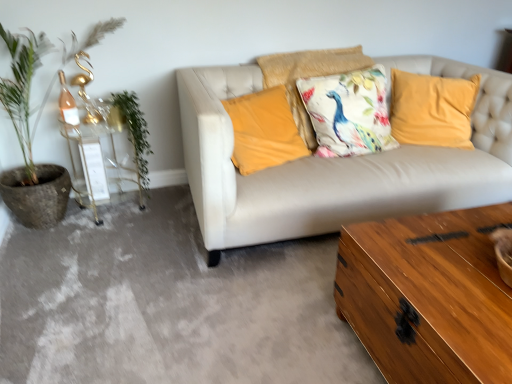
Where is `wooden chest at lower right`? The height and width of the screenshot is (384, 512). wooden chest at lower right is located at coordinates (169, 304).

The image size is (512, 384). I want to click on clear glass side table at left, so click(x=87, y=153).

Image resolution: width=512 pixels, height=384 pixels. Identify the location of green leafy plant at left. (24, 88).

The image size is (512, 384). What do you see at coordinates (349, 112) in the screenshot?
I see `floral cotton cushion at center, which ranks as the 3th pillow in left-to-right order` at bounding box center [349, 112].

Measure the distance between floral fabric cushion at center, which ranks as the second pillow in right-to-left order, and camera.

A distance of 8.14 feet exists between floral fabric cushion at center, which ranks as the second pillow in right-to-left order, and camera.

What do you see at coordinates (308, 77) in the screenshot?
I see `floral fabric cushion at center, which ranks as the second pillow in right-to-left order` at bounding box center [308, 77].

You are a GUI agent. You are given a task and a screenshot of the screen. Output one action in this format:
    pyautogui.click(x=<x>, y=<y>)
    Task: Click on the green leafy plant at left
    
    Given the screenshot: What is the action you would take?
    pyautogui.click(x=135, y=137)

This screenshot has height=384, width=512. What do you see at coordinates (264, 130) in the screenshot?
I see `velvet yellow pillow at center, the 3th pillow when ordered from right to left` at bounding box center [264, 130].

Find the location of a particular element. This screenshot has width=512, height=384. wooden chest at lower right is located at coordinates (169, 304).

From a real-world perspective, which is physically above, floral cotton cushion at center, which ranks as the 3th pillow in left-to-right order, or shiny brown wooden trunk at lower right?

floral cotton cushion at center, which ranks as the 3th pillow in left-to-right order, is physically above.

Is floral cotton cushion at center, which ranks as the 3th pillow in left-to-right order, to the left or to the right of shiny brown wooden trunk at lower right in the image?

Based on their positions, floral cotton cushion at center, which ranks as the 3th pillow in left-to-right order, is located to the left of shiny brown wooden trunk at lower right.

Which is more to the right, green leafy plant at left or wooden chest at lower right?

wooden chest at lower right is more to the right.

Are green leafy plant at left and wooden chest at lower right far apart?

green leafy plant at left is near wooden chest at lower right, not far away.

Is wooden chest at lower right inside green leafy plant at left?

No, wooden chest at lower right is not surrounded by green leafy plant at left.

Which is behind, point (140, 149) or point (354, 336)?

The point (140, 149) is more distant.

Which object is further away from the camera, velvet yellow pillow at center, placed as the 1th pillow when sorted from left to right, or green leafy plant at left?

green leafy plant at left.

From the picture: Who is bigger, velvet yellow pillow at center, placed as the 1th pillow when sorted from left to right, or green leafy plant at left?

velvet yellow pillow at center, placed as the 1th pillow when sorted from left to right.

Is velvet yellow pillow at center, placed as the 1th pillow when sorted from left to right, oriented towards green leafy plant at left?

No.

From a real-world perspective, is floral cotton cushion at center, marked as the 1th pillow in a right-to-left arrangement, positioned over wooden chest at lower right based on gravity?

Indeed, from a real-world perspective, floral cotton cushion at center, marked as the 1th pillow in a right-to-left arrangement, stands above wooden chest at lower right.

In the image, is floral cotton cushion at center, marked as the 1th pillow in a right-to-left arrangement, positioned in front of or behind wooden chest at lower right?

In the image, floral cotton cushion at center, marked as the 1th pillow in a right-to-left arrangement, appears behind wooden chest at lower right.

Can you tell me how much floral cotton cushion at center, marked as the 1th pillow in a right-to-left arrangement, and wooden chest at lower right differ in facing direction?

They differ by 89.6 degrees in their facing directions.

Is point (387, 143) farther from viewer compared to point (222, 333)?

Yes.

Is floral fabric cushion at center, which ranks as the second pillow in right-to-left order, completely or partially inside green leafy plant at left?

No, floral fabric cushion at center, which ranks as the second pillow in right-to-left order, is not inside green leafy plant at left.

From the image's perspective, which is below, green leafy plant at left or floral fabric cushion at center, which ranks as the second pillow in right-to-left order?

green leafy plant at left, from the image's perspective.

Who is shorter, green leafy plant at left or floral fabric cushion at center, which ranks as the second pillow in right-to-left order?

floral fabric cushion at center, which ranks as the second pillow in right-to-left order, is shorter.

Does point (135, 117) appear closer or farther from the camera than point (297, 115)?

Point (135, 117) appears to be closer to the viewer than point (297, 115).

Would you say green leafy plant at left is a long distance from velvet yellow pillow at center, the 3th pillow when ordered from right to left?

That's right, there is a large distance between green leafy plant at left and velvet yellow pillow at center, the 3th pillow when ordered from right to left.

Based on the photo, is green leafy plant at left taller than velvet yellow pillow at center, placed as the 1th pillow when sorted from left to right?

Indeed, green leafy plant at left has a greater height compared to velvet yellow pillow at center, placed as the 1th pillow when sorted from left to right.

Which point is more distant from viewer, (105, 28) or (265, 128)?

The point (105, 28) is farther.

Between green leafy plant at left and velvet yellow pillow at center, the 3th pillow when ordered from right to left, which one has smaller width?

Thinner between the two is velvet yellow pillow at center, the 3th pillow when ordered from right to left.

From a real-world perspective, is velvet yellow pillow at center, placed as the 1th pillow when sorted from left to right, positioned under floral cotton cushion at center, which ranks as the 3th pillow in left-to-right order, based on gravity?

Yes, from a real-world perspective, velvet yellow pillow at center, placed as the 1th pillow when sorted from left to right, is below floral cotton cushion at center, which ranks as the 3th pillow in left-to-right order.

Find the location of a particular element. pillow that is the 1st one when counting backward from the velvet yellow pillow at center, placed as the 1th pillow when sorted from left to right is located at coordinates (349, 112).

Which is more to the left, velvet yellow pillow at center, placed as the 1th pillow when sorted from left to right, or floral cotton cushion at center, which ranks as the 3th pillow in left-to-right order?

Positioned to the left is velvet yellow pillow at center, placed as the 1th pillow when sorted from left to right.

Which pillow is the 1st one when counting from the left side of the shiny brown wooden trunk at lower right? Please provide its 2D coordinates.

[(349, 112)]

The width and height of the screenshot is (512, 384). What are the coordinates of `plant above the wooden chest at lower right (from the image's perspective)` in the screenshot? It's located at (135, 137).

Which object lies further to the anchor point green leafy plant at left, green leafy plant at left or floral cotton cushion at center, marked as the 1th pillow in a right-to-left arrangement?

Among the two, floral cotton cushion at center, marked as the 1th pillow in a right-to-left arrangement, is located further to green leafy plant at left.

Which object lies nearer to the anchor point green leafy plant at left, velvet yellow pillow at center, placed as the 1th pillow when sorted from left to right, or floral cotton cushion at center, marked as the 1th pillow in a right-to-left arrangement?

velvet yellow pillow at center, placed as the 1th pillow when sorted from left to right, is closer to green leafy plant at left.

Estimate the real-world distances between objects in this image. Which object is closer to green leafy plant at left, wooden chest at lower right or clear glass side table at left?

Among the two, clear glass side table at left is located nearer to green leafy plant at left.

Looking at the image, which one is located closer to velvet yellow pillow at center, the 3th pillow when ordered from right to left, clear glass side table at left or green leafy plant at left?

green leafy plant at left.

When comparing their distances from floral fabric cushion at center, which ranks as the second pillow in right-to-left order, does gold metallic table lamp at left or clear glass side table at left seem further?

gold metallic table lamp at left is positioned further to the anchor floral fabric cushion at center, which ranks as the second pillow in right-to-left order.

Looking at the image, which one is located further to green leafy plant at left, gold metallic table lamp at left or floral cotton cushion at center, marked as the 1th pillow in a right-to-left arrangement?

floral cotton cushion at center, marked as the 1th pillow in a right-to-left arrangement, lies further to green leafy plant at left than the other object.

Considering their positions, is green leafy plant at left positioned closer to floral fabric cushion at center, the 2th pillow positioned from the left, than velvet yellow pillow at center, the 3th pillow when ordered from right to left?

Among the two, velvet yellow pillow at center, the 3th pillow when ordered from right to left, is located nearer to floral fabric cushion at center, the 2th pillow positioned from the left.

Considering their positions, is clear glass side table at left positioned further to gold metallic table lamp at left than green leafy plant at left?

clear glass side table at left lies further to gold metallic table lamp at left than the other object.

Identify the location of houseplant between wooden chest at lower right and green leafy plant at left along the z-axis. (24, 88).

Locate an element on the screen. side table located between gold metallic table lamp at left and shiny brown wooden trunk at lower right in the left-right direction is located at coordinates (87, 153).

The height and width of the screenshot is (384, 512). I want to click on pillow between green leafy plant at left and floral fabric cushion at center, the 2th pillow positioned from the left, in the horizontal direction, so click(264, 130).

This screenshot has height=384, width=512. What are the coordinates of `pillow between gold metallic table lamp at left and floral fabric cushion at center, which ranks as the second pillow in right-to-left order` in the screenshot? It's located at (264, 130).